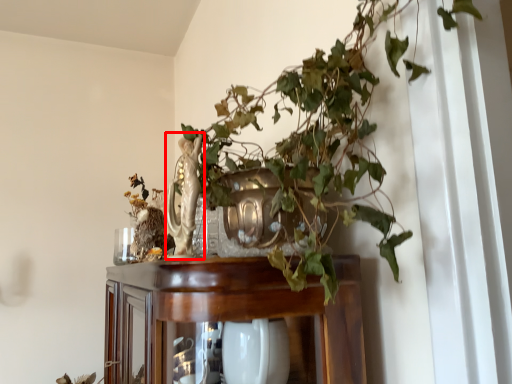
Question: Considering the relative positions of sculpture (annotated by the red box) and furniture in the image provided, where is sculpture (annotated by the red box) located with respect to the staircase?

Choices:
 (A) left
 (B) right

Answer: (B)